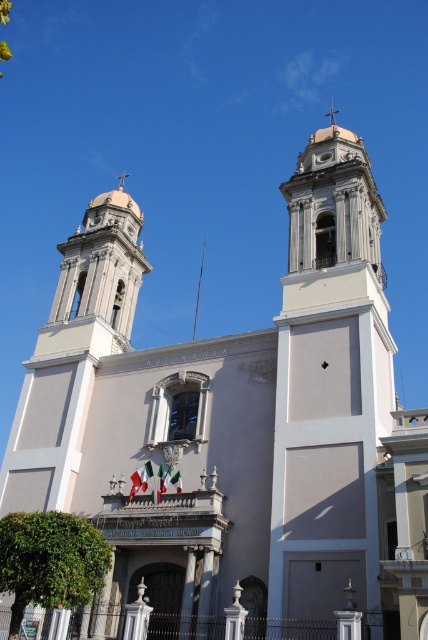
Does white marble bell tower at upper center have a lesser width compared to matte white bell tower at upper left?

Correct, white marble bell tower at upper center's width is less than matte white bell tower at upper left's.

Is white marble bell tower at upper center to the left of matte white bell tower at upper left from the viewer's perspective?

No, white marble bell tower at upper center is not to the left of matte white bell tower at upper left.

Which is in front, point (275, 556) or point (97, 268)?

Point (275, 556)

At what (x,y) coordinates should I click in order to perform the action: click on white marble bell tower at upper center. Please return your answer as a coordinate pair (x, y). This screenshot has height=640, width=428. Looking at the image, I should click on (329, 384).